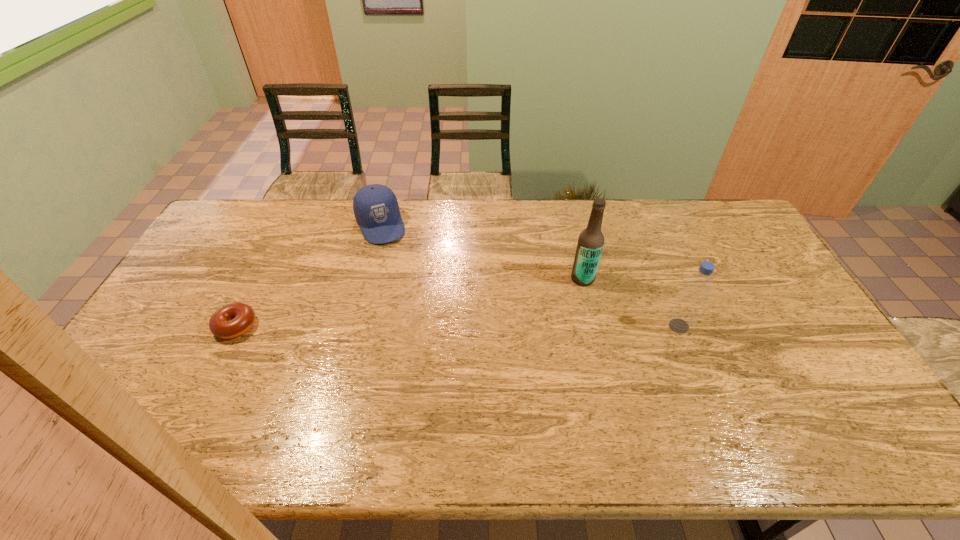
Identify the location of doughnut. This screenshot has width=960, height=540. (232, 320).

Locate an element on the screen. The image size is (960, 540). the shortest object is located at coordinates (232, 320).

I want to click on bottle, so click(698, 286).

The width and height of the screenshot is (960, 540). I want to click on the second tallest object, so click(698, 286).

Image resolution: width=960 pixels, height=540 pixels. In order to click on beer bottle in this screenshot , I will do `click(590, 243)`.

Find the location of a particular element. The image size is (960, 540). the tallest object is located at coordinates (590, 243).

I want to click on the third object from right to left, so click(375, 206).

Locate an element on the screen. cap is located at coordinates (375, 206).

Where is `free spot located 0.140m on the front of the shortest object`? Image resolution: width=960 pixels, height=540 pixels. free spot located 0.140m on the front of the shortest object is located at coordinates (205, 387).

Where is `free spot located on the left of the third shortest object`? The height and width of the screenshot is (540, 960). free spot located on the left of the third shortest object is located at coordinates (600, 326).